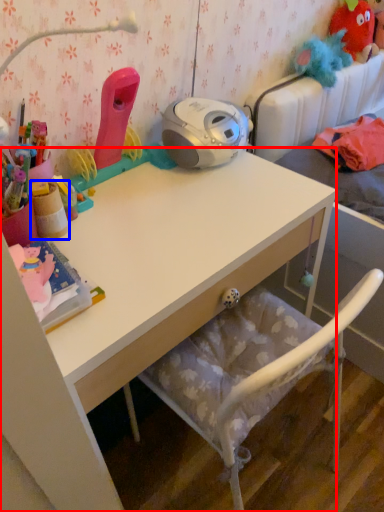
Question: Which of the following is the closest to the observer, desk (highlighted by a red box) or stationery (highlighted by a blue box)?

Choices:
 (A) desk
 (B) stationery

Answer: (A)